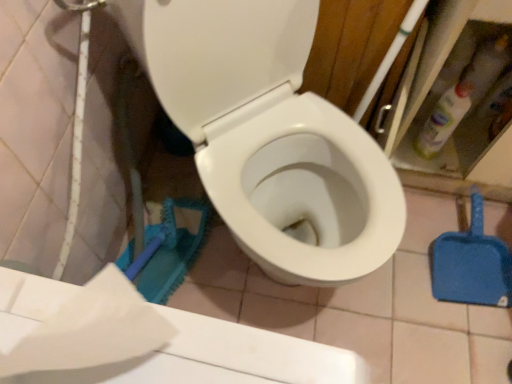
Question: Is white glossy toilet at center thinner than blue plastic shovel at lower right?

Choices:
 (A) yes
 (B) no

Answer: (B)

Question: Can you confirm if white glossy toilet at center is taller than blue plastic shovel at lower right?

Choices:
 (A) yes
 (B) no

Answer: (A)

Question: Can you confirm if white glossy toilet at center is wider than blue plastic shovel at lower right?

Choices:
 (A) yes
 (B) no

Answer: (A)

Question: Is white glossy toilet at center smaller than blue plastic shovel at lower right?

Choices:
 (A) no
 (B) yes

Answer: (A)

Question: Would you say white glossy toilet at center is a long distance from blue plastic shovel at lower right?

Choices:
 (A) no
 (B) yes

Answer: (A)

Question: Is white glossy toilet at center inside the boundaries of white matte toilet paper at lower left, or outside?

Choices:
 (A) inside
 (B) outside

Answer: (B)

Question: Visually, is white glossy toilet at center positioned to the left or to the right of white matte toilet paper at lower left?

Choices:
 (A) right
 (B) left

Answer: (A)

Question: Considering their positions, is white glossy toilet at center located in front of or behind white matte toilet paper at lower left?

Choices:
 (A) behind
 (B) front

Answer: (A)

Question: From the image's perspective, relative to white matte toilet paper at lower left, is white glossy toilet at center above or below?

Choices:
 (A) above
 (B) below

Answer: (A)

Question: Is point (456, 119) closer or farther from the camera than point (92, 299)?

Choices:
 (A) farther
 (B) closer

Answer: (A)

Question: From their relative heights in the image, would you say translucent plastic bottle at upper right is taller or shorter than white matte toilet paper at lower left?

Choices:
 (A) tall
 (B) short

Answer: (A)

Question: Looking at their shapes, would you say translucent plastic bottle at upper right is wider or thinner than white matte toilet paper at lower left?

Choices:
 (A) wide
 (B) thin

Answer: (B)

Question: Based on their sizes in the image, would you say translucent plastic bottle at upper right is bigger or smaller than white matte toilet paper at lower left?

Choices:
 (A) big
 (B) small

Answer: (B)

Question: Is blue plastic shovel at lower right bigger or smaller than white glossy toilet at center?

Choices:
 (A) small
 (B) big

Answer: (A)

Question: In the image, is blue plastic shovel at lower right on the left side or the right side of white glossy toilet at center?

Choices:
 (A) right
 (B) left

Answer: (A)